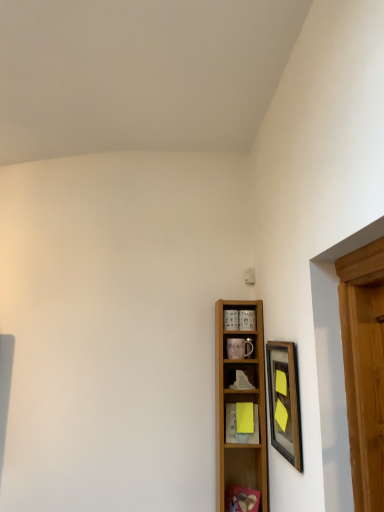
Question: Does yellow paper at center, the 3th shelf viewed from the top, lie in front of wooden shelf at center, the third shelf ordered from the bottom?

Choices:
 (A) yes
 (B) no

Answer: (A)

Question: Is yellow paper at center, which is the 1th shelf from bottom to top, next to wooden shelf at center, the first shelf in the top-to-bottom sequence, and touching it?

Choices:
 (A) yes
 (B) no

Answer: (B)

Question: Is yellow paper at center, the 3th shelf viewed from the top, not close to wooden shelf at center, the third shelf ordered from the bottom?

Choices:
 (A) no
 (B) yes

Answer: (A)

Question: From a real-world perspective, is yellow paper at center, which is the 1th shelf from bottom to top, physically below wooden shelf at center, the third shelf ordered from the bottom?

Choices:
 (A) yes
 (B) no

Answer: (A)

Question: Can you confirm if yellow paper at center, the 3th shelf viewed from the top, is positioned to the right of wooden shelf at center, the first shelf in the top-to-bottom sequence?

Choices:
 (A) yes
 (B) no

Answer: (A)

Question: In terms of width, does wooden shelf at center, placed as the second shelf when sorted from bottom to top, look wider or thinner when compared to wooden framed picture at right?

Choices:
 (A) thin
 (B) wide

Answer: (B)

Question: Is point (263, 486) closer or farther from the camera than point (286, 399)?

Choices:
 (A) farther
 (B) closer

Answer: (A)

Question: Is wooden shelf at center, placed as the second shelf when sorted from bottom to top, bigger or smaller than wooden framed picture at right?

Choices:
 (A) big
 (B) small

Answer: (A)

Question: From a real-world perspective, is wooden shelf at center, the second shelf viewed from the top, physically located above or below wooden framed picture at right?

Choices:
 (A) below
 (B) above

Answer: (A)

Question: Which is correct: wooden framed picture at right is inside yellow paper at center, which is the 1th shelf from bottom to top, or outside of it?

Choices:
 (A) outside
 (B) inside

Answer: (A)

Question: In terms of height, does wooden framed picture at right look taller or shorter compared to yellow paper at center, the 3th shelf viewed from the top?

Choices:
 (A) short
 (B) tall

Answer: (B)

Question: Considering the positions of wooden framed picture at right and yellow paper at center, which is the 1th shelf from bottom to top, in the image, is wooden framed picture at right wider or thinner than yellow paper at center, which is the 1th shelf from bottom to top,?

Choices:
 (A) thin
 (B) wide

Answer: (A)

Question: From the image's perspective, is wooden framed picture at right above or below yellow paper at center, the 3th shelf viewed from the top?

Choices:
 (A) below
 (B) above

Answer: (B)

Question: In terms of height, does yellow paper at center, the 3th shelf viewed from the top, look taller or shorter compared to wooden framed picture at right?

Choices:
 (A) tall
 (B) short

Answer: (B)

Question: From a real-world perspective, is yellow paper at center, the 3th shelf viewed from the top, positioned above or below wooden framed picture at right?

Choices:
 (A) above
 (B) below

Answer: (B)